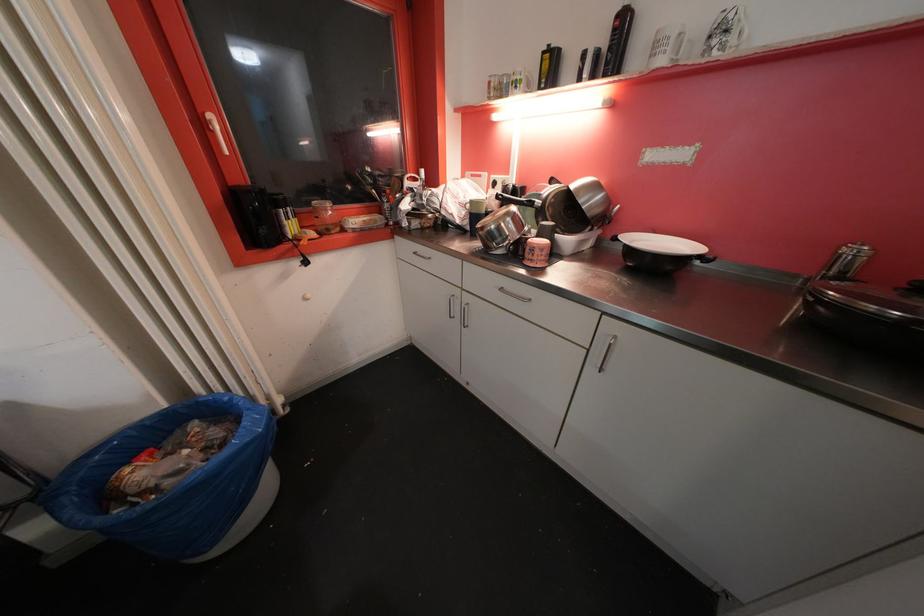
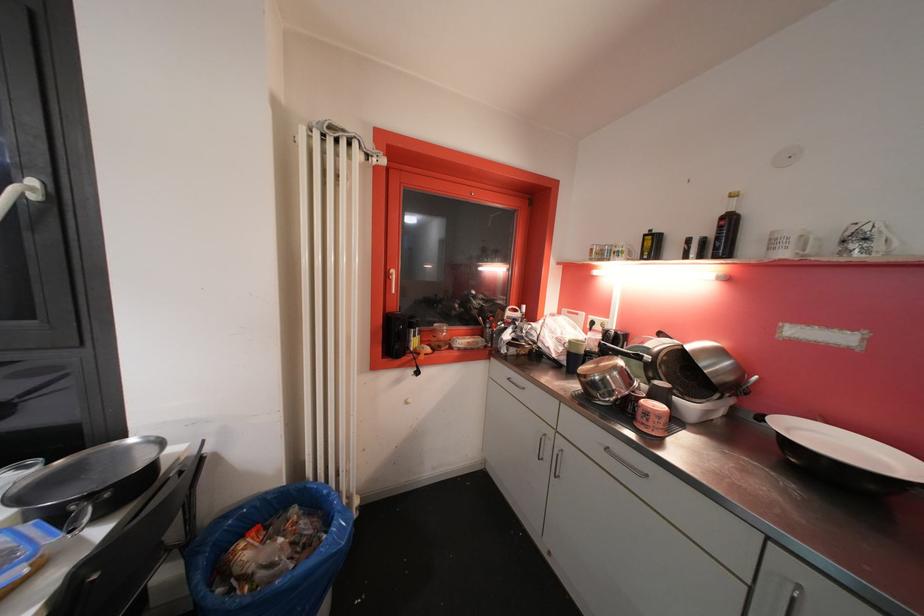
How did the camera likely rotate?

The camera rotated toward left-up.